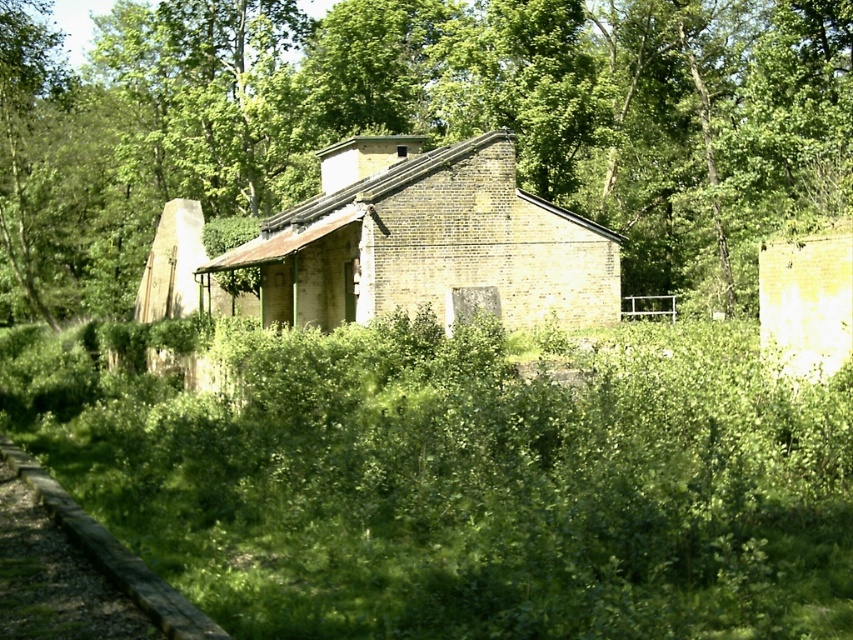
Based on the photo, you are a hiker who wants to take a photo of the yellow brick hut at center without the green leafy tree at center blocking the view. Based on their heights, which direction should you move to ensure the tree doesn

The green leafy tree at center is taller than the yellow brick hut at center. To avoid the tree blocking the view of the yellow brick hut at center, you should move to a higher elevation or position yourself so that the tree is lower in your line of sight compared to the hut. Alternatively, moving to the side where the tree is not directly in front might help, but since the tree is taller, adjusting your vertical position would be more effective.

You are a photographer planning to take a picture of the green leafy tree at center and the yellow brick hut at center. Based on their sizes, which one should you focus on to ensure it fills the frame better?

The green leafy tree at center is larger in size than the yellow brick hut at center, so focusing on the green leafy tree at center will fill the frame better.

You are standing in front of the rustic brick building and want to plant a new tree exactly where the green leafy tree at center is currently located. What are the coordinates of the spot where you should plant the new tree?

The coordinates for the green leafy tree at center are at point (419, 122), so you should plant the new tree at those coordinates.